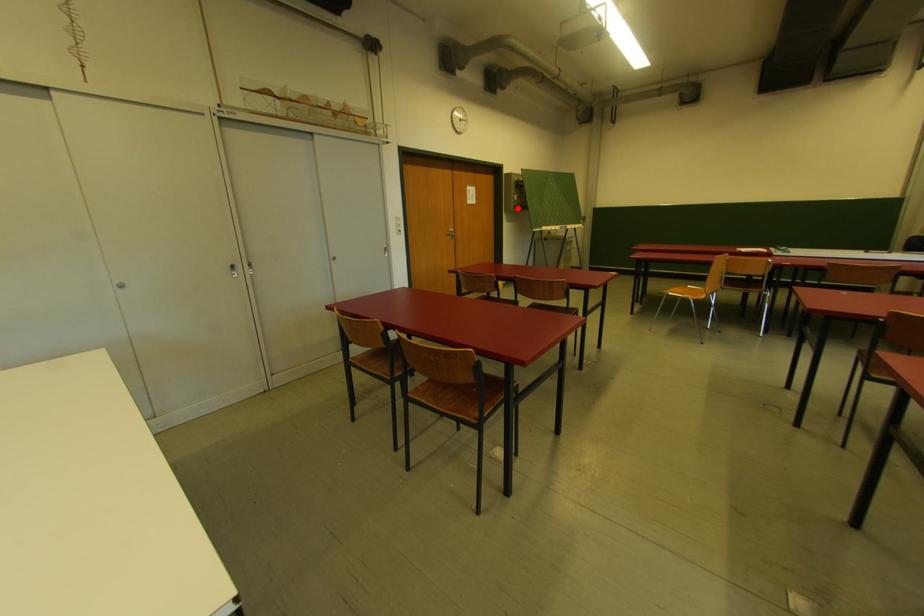
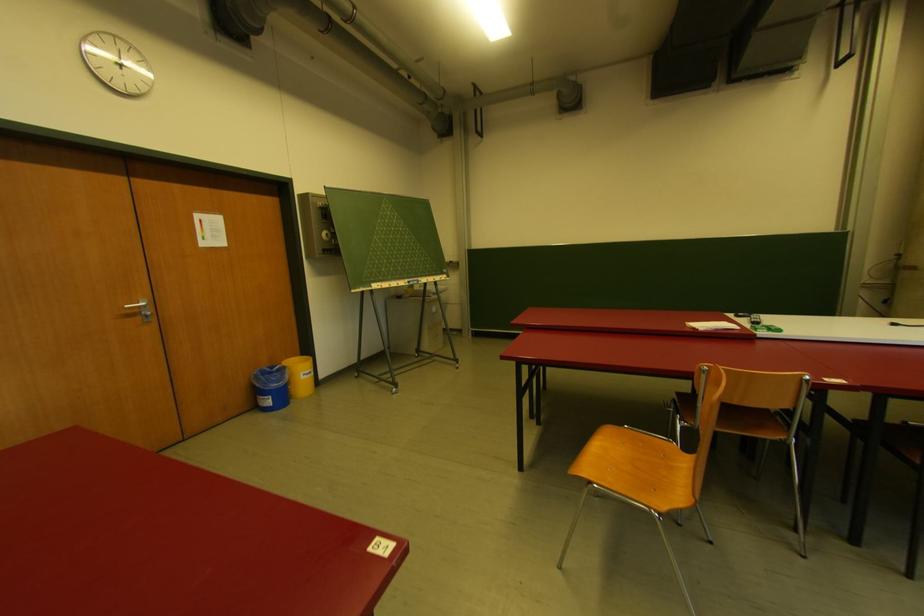
The point at the highlighted location is marked in the first image. Where is the corresponding point in the second image?

(326, 252)